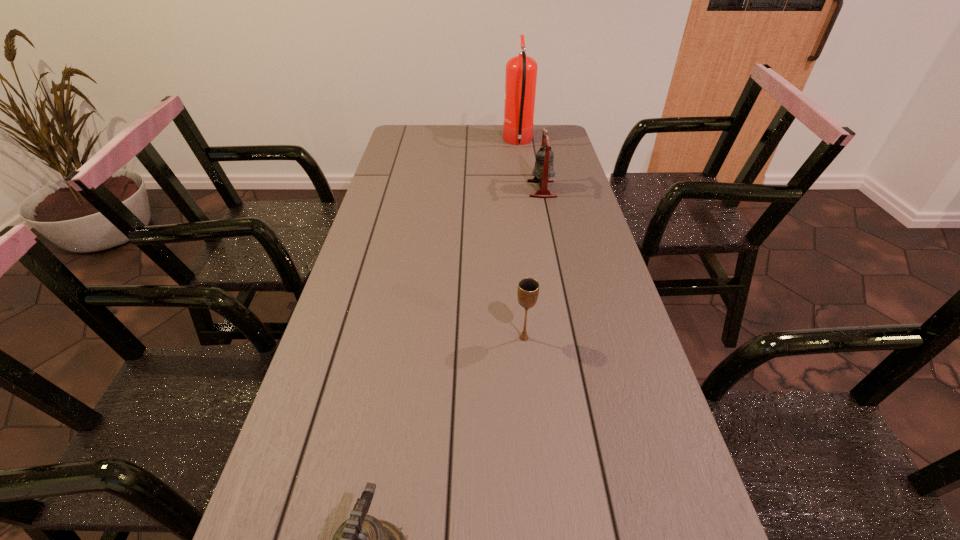
Find the location of `object situated at the far edge`. object situated at the far edge is located at coordinates (521, 71).

Locate an element on the screen. fire extinguisher that is at the right edge is located at coordinates (521, 71).

Where is `bell located at the right edge`? This screenshot has width=960, height=540. bell located at the right edge is located at coordinates (543, 170).

You are a GUI agent. You are given a task and a screenshot of the screen. Output one action in this format:
    pyautogui.click(x=<x>, y=<y>)
    Task: Click on the object that is at the far right corner
    
    Given the screenshot: What is the action you would take?
    pyautogui.click(x=521, y=71)

The image size is (960, 540). Identify the location of free location at the far edge. (473, 132).

In the image, there is a desktop. Identify the location of vacant space at the left edge. point(399,255).

The image size is (960, 540). In order to click on vacant space at the right edge of the desktop in this screenshot , I will do `click(605, 301)`.

Identify the location of vacant position at the far left corner of the desktop. This screenshot has width=960, height=540. (392, 141).

Where is `vacant region at the far right corner of the desktop`? vacant region at the far right corner of the desktop is located at coordinates (560, 129).

You are a GUI agent. You are given a task and a screenshot of the screen. Output one action in this format:
    pyautogui.click(x=<x>, y=<y>)
    Task: Click on the free space between the chalice and the farther bell
    The width and height of the screenshot is (960, 540).
    Given the screenshot: What is the action you would take?
    pyautogui.click(x=533, y=264)